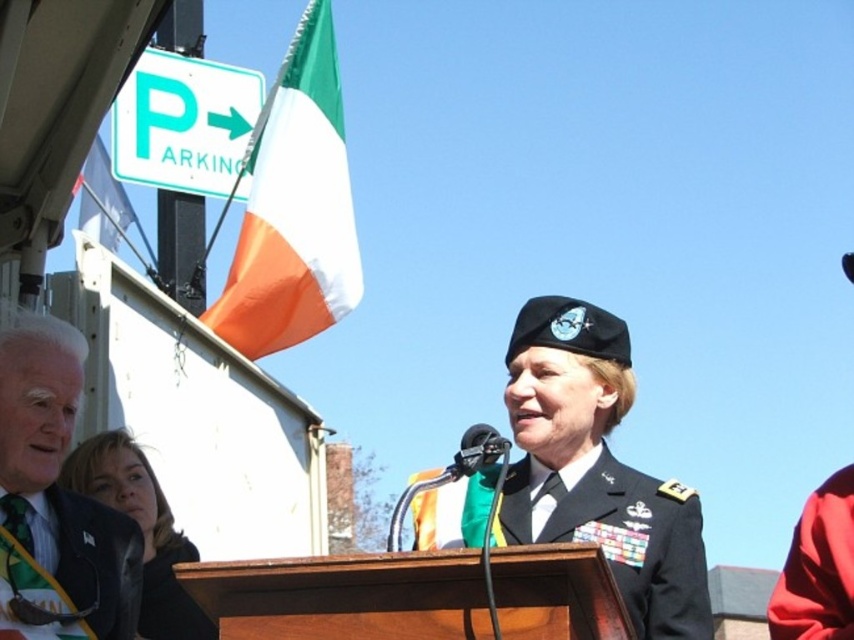
Question: Estimate the real-world distances between objects in this image. Which object is farther from the irish tricolor flag at upper left?

Choices:
 (A) dark gray suit at left
 (B) metallic black microphone at center
 (C) dark green fabric uniform at lower left

Answer: (C)

Question: Does matte black uniform at center appear over black matte microphone at center?

Choices:
 (A) yes
 (B) no

Answer: (B)

Question: Can you confirm if dark green fabric uniform at lower left is smaller than smooth black hair at lower left?

Choices:
 (A) no
 (B) yes

Answer: (A)

Question: Is black uniform at center positioned before black military uniform at center?

Choices:
 (A) yes
 (B) no

Answer: (B)

Question: Which of these objects is positioned closest to the dark green fabric uniform at lower left?

Choices:
 (A) black uniform at center
 (B) smooth black hair at lower left
 (C) metallic black microphone at center
 (D) irish tricolor flag at upper left

Answer: (B)

Question: Which point appears farthest from the camera in this image?

Choices:
 (A) (308, 138)
 (B) (173, 636)
 (C) (10, 426)

Answer: (A)